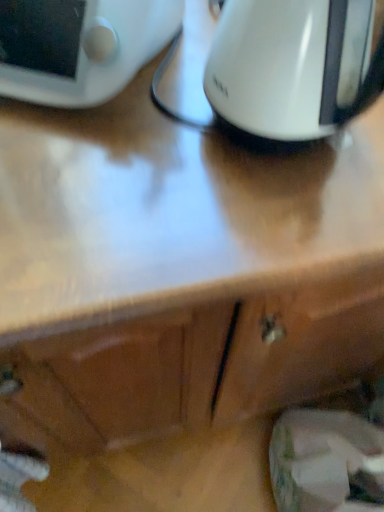
The width and height of the screenshot is (384, 512). What do you see at coordinates (80, 47) in the screenshot?
I see `white glossy digital clock at upper left` at bounding box center [80, 47].

This screenshot has height=512, width=384. Identify the location of white glossy digital clock at upper left. (80, 47).

What are the coordinates of `white glossy kettle at upper center` in the screenshot? It's located at (293, 67).

Describe the element at coordinates (293, 67) in the screenshot. This screenshot has width=384, height=512. I see `white glossy kettle at upper center` at that location.

The image size is (384, 512). What are the coordinates of `white glossy digital clock at upper left` in the screenshot? It's located at (80, 47).

Based on their positions, is white glossy kettle at upper center located to the left or right of white glossy digital clock at upper left?

Clearly, white glossy kettle at upper center is on the right of white glossy digital clock at upper left in the image.

Which object is further away from the camera, white glossy kettle at upper center or white glossy digital clock at upper left?

white glossy digital clock at upper left is further away from the camera.

Is point (262, 91) positioned after point (53, 14)?

No, it is in front of (53, 14).

From the image's perspective, between white glossy kettle at upper center and white glossy digital clock at upper left, which one is located above?

white glossy digital clock at upper left.

From a real-world perspective, who is located higher, white glossy kettle at upper center or white glossy digital clock at upper left?

white glossy kettle at upper center is physically above.

Is white glossy kettle at upper center wider or thinner than white glossy digital clock at upper left?

Considering their sizes, white glossy kettle at upper center looks slimmer than white glossy digital clock at upper left.

Can you confirm if white glossy kettle at upper center is shorter than white glossy digital clock at upper left?

In fact, white glossy kettle at upper center may be taller than white glossy digital clock at upper left.

Can you confirm if white glossy kettle at upper center is smaller than white glossy digital clock at upper left?

Indeed, white glossy kettle at upper center has a smaller size compared to white glossy digital clock at upper left.

Is white glossy kettle at upper center completely or partially outside of white glossy digital clock at upper left?

Yes, white glossy kettle at upper center is located beyond the bounds of white glossy digital clock at upper left.

Is white glossy kettle at upper center with white glossy digital clock at upper left?

No, white glossy kettle at upper center is not with white glossy digital clock at upper left.

Is white glossy kettle at upper center aimed at white glossy digital clock at upper left?

No, white glossy kettle at upper center is not turned towards white glossy digital clock at upper left.

How different are the orientations of white glossy kettle at upper center and white glossy digital clock at upper left in degrees?

The angular difference between white glossy kettle at upper center and white glossy digital clock at upper left is 24.7 degrees.

At what (x,y) coordinates should I click in order to perform the action: click on home appliance that is under the white glossy kettle at upper center (from a real-world perspective). Please return your answer as a coordinate pair (x, y). Looking at the image, I should click on (80, 47).

Visually, is white glossy digital clock at upper left positioned to the left or to the right of white glossy kettle at upper center?

In the image, white glossy digital clock at upper left appears on the left side of white glossy kettle at upper center.

Consider the image. Which object is further away from the camera taking this photo, white glossy digital clock at upper left or white glossy kettle at upper center?

Positioned behind is white glossy digital clock at upper left.

Which point is more forward, [28,58] or [276,31]?

The point [276,31] is closer.

From the image's perspective, would you say white glossy digital clock at upper left is positioned over white glossy kettle at upper center?

Yes, from the image's perspective, white glossy digital clock at upper left is above white glossy kettle at upper center.

From a real-world perspective, is white glossy digital clock at upper left below white glossy kettle at upper center?

Yes, from a real-world perspective, white glossy digital clock at upper left is beneath white glossy kettle at upper center.

Can you confirm if white glossy digital clock at upper left is wider than white glossy kettle at upper center?

Yes, white glossy digital clock at upper left is wider than white glossy kettle at upper center.

Considering the sizes of objects white glossy digital clock at upper left and white glossy kettle at upper center in the image provided, who is shorter, white glossy digital clock at upper left or white glossy kettle at upper center?

white glossy digital clock at upper left is shorter.

Looking at the image, does white glossy digital clock at upper left seem bigger or smaller compared to white glossy kettle at upper center?

white glossy digital clock at upper left is bigger than white glossy kettle at upper center.

Would you say white glossy digital clock at upper left contains white glossy kettle at upper center?

No, white glossy kettle at upper center is not surrounded by white glossy digital clock at upper left.

Would you say white glossy digital clock at upper left is a long distance from white glossy kettle at upper center?

They are positioned close to each other.

Is white glossy digital clock at upper left turned away from white glossy kettle at upper center?

No, white glossy digital clock at upper left is not facing away from white glossy kettle at upper center.

What's the angular difference between white glossy digital clock at upper left and white glossy kettle at upper center's facing directions?

The facing directions of white glossy digital clock at upper left and white glossy kettle at upper center are 24.7 degrees apart.

How much distance is there between white glossy digital clock at upper left and white glossy kettle at upper center?

They are 6.85 inches apart.

Where is `home appliance on the left of the white glossy kettle at upper center`? The height and width of the screenshot is (512, 384). home appliance on the left of the white glossy kettle at upper center is located at coordinates (80, 47).

In order to click on home appliance on the left of white glossy kettle at upper center in this screenshot , I will do `click(80, 47)`.

Locate an element on the screen. This screenshot has height=512, width=384. home appliance above the white glossy kettle at upper center (from the image's perspective) is located at coordinates (80, 47).